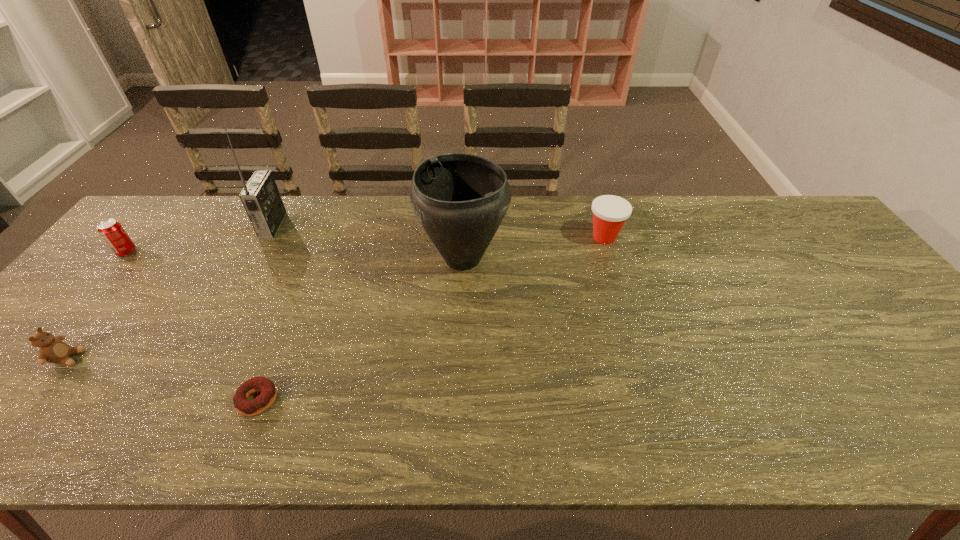
Locate an element on the screen. free space between the leftmost object and the third object from right to left is located at coordinates (192, 326).

Identify the location of unoccupied area between the nearest object and the rightmost object. This screenshot has height=540, width=960. (431, 319).

Locate an element on the screen. This screenshot has width=960, height=540. blank region between the fourth object from left to right and the rightmost object is located at coordinates (431, 319).

Find the location of `free point between the shortest object and the rightmost object`. free point between the shortest object and the rightmost object is located at coordinates (431, 319).

Identify the location of empty space between the fifth object from left to right and the doughnut. (360, 329).

Locate which object is the fifth closest to the Dixie cup. Please provide its 2D coordinates. Your answer should be formatted as a tuple, i.e. [(x, y)], where the tuple contains the x and y coordinates of a point satisfying the conditions above.

[(112, 232)]

Locate which object is the fifth closest to the radio receiver. Please provide its 2D coordinates. Your answer should be formatted as a tuple, i.e. [(x, y)], where the tuple contains the x and y coordinates of a point satisfying the conditions above.

[(610, 212)]

Identify the location of vacant space that satisfies the following two spatial constraints: 1. on the display of the nearest object; 2. on the left side of the radio receiver. (180, 400).

You are a GUI agent. You are given a task and a screenshot of the screen. Output one action in this format:
    pyautogui.click(x=<x>, y=<y>)
    Task: Click on the blank space that satisfies the following two spatial constraints: 1. on the display of the radio receiver; 2. on the back side of the rightmost object
    This screenshot has width=960, height=540.
    Given the screenshot: What is the action you would take?
    pyautogui.click(x=267, y=237)

You are a GUI agent. You are given a task and a screenshot of the screen. Output one action in this format:
    pyautogui.click(x=<x>, y=<y>)
    Task: Click on the free spot that satisfies the following two spatial constraints: 1. on the display of the nearest object; 2. on the left side of the fourth object from right to left
    This screenshot has height=540, width=960.
    Given the screenshot: What is the action you would take?
    pyautogui.click(x=180, y=400)